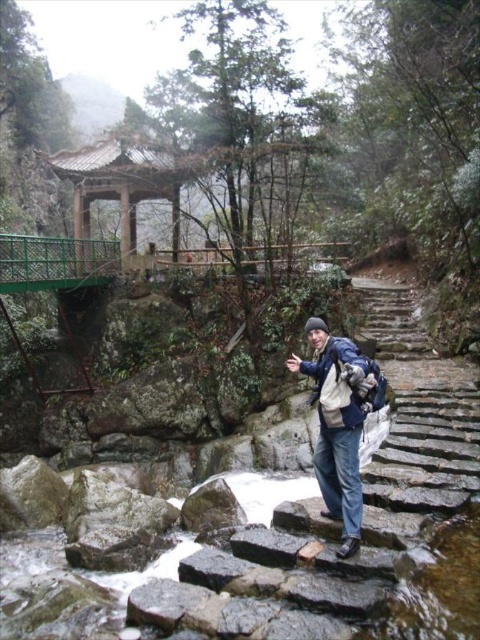
Locate an element on the screen. The width and height of the screenshot is (480, 640). blue fabric backpack at center is located at coordinates (339, 422).

This screenshot has height=640, width=480. What do you see at coordinates (339, 422) in the screenshot?
I see `blue fabric backpack at center` at bounding box center [339, 422].

Between point (363, 356) and point (151, 244), which one is positioned behind?

The point (151, 244) is behind.

Locate an element on the screen. This screenshot has height=640, width=480. blue fabric backpack at center is located at coordinates (339, 422).